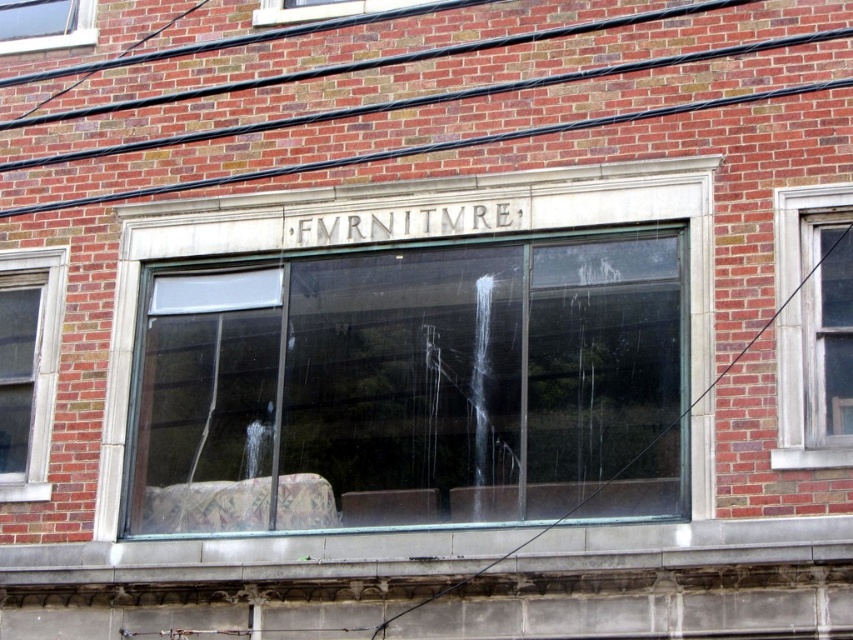
You are standing in front of a brick building with a large window. There is a point marked at coordinates (811, 371). Which object does this point correspond to?

The point at coordinates (811, 371) marks the clear glass window at center.

You are standing in front of the brick building and want to touch the clear glass furniture at center and the clear glass window at upper left. Which one can you reach without moving closer?

The clear glass furniture at center is closer to the viewer than the clear glass window at upper left, so you can reach the clear glass furniture at center without moving closer.